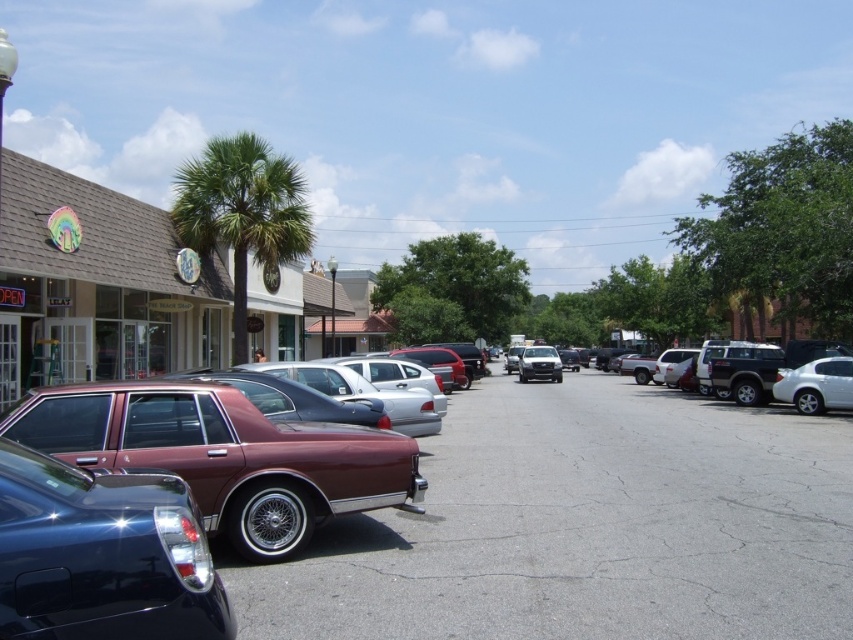
Question: In this image, where is green leafy palm tree at center located relative to white glossy sedan at right?

Choices:
 (A) below
 (B) above

Answer: (B)

Question: Considering the relative positions of shiny metallic car at center and green leafy palm tree at center in the image provided, where is shiny metallic car at center located with respect to green leafy palm tree at center?

Choices:
 (A) above
 (B) below

Answer: (B)

Question: Which is nearer to the white glossy sedan at right?

Choices:
 (A) satin silver sedan at center
 (B) green leafy palm tree at center
 (C) glossy dark blue sedan at lower left

Answer: (B)

Question: Can you confirm if maroon metallic sedan at lower left is bigger than beige stucco building at left?

Choices:
 (A) yes
 (B) no

Answer: (B)

Question: Among these objects, which one is nearest to the camera?

Choices:
 (A) maroon metallic sedan at lower left
 (B) shiny metallic car at center

Answer: (B)

Question: Which of the following is the farthest from the observer?

Choices:
 (A) (607, 477)
 (B) (833, 401)
 (C) (97, 627)
 (D) (24, 307)

Answer: (B)